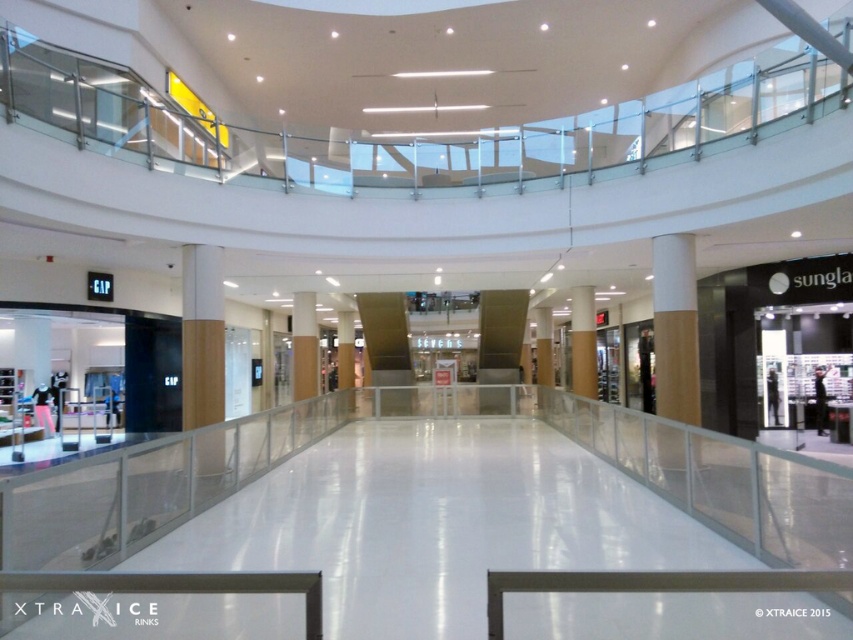
Is brown wood pillar at center bigger than smooth beige pillar at center?

No.

Locate an element on the screen. This screenshot has width=853, height=640. brown wood pillar at center is located at coordinates (305, 346).

What do you see at coordinates (305, 346) in the screenshot? The height and width of the screenshot is (640, 853). I see `brown wood pillar at center` at bounding box center [305, 346].

This screenshot has height=640, width=853. I want to click on brown wood pillar at center, so click(x=305, y=346).

Who is positioned more to the left, white wood column at center or wooden pillar at center?

wooden pillar at center

Is white wood column at center thinner than wooden pillar at center?

Yes.

Is point (685, 324) farther from viewer compared to point (194, 344)?

No, (685, 324) is in front of (194, 344).

This screenshot has width=853, height=640. Identify the location of white wood column at center. (675, 326).

Is wooden pillar at center positioned in front of smooth beige pillar at center?

Yes, wooden pillar at center is closer to the viewer.

Is point (189, 312) behind point (550, 349)?

No, (189, 312) is in front of (550, 349).

Image resolution: width=853 pixels, height=640 pixels. In order to click on wooden pillar at center in this screenshot , I will do `click(202, 337)`.